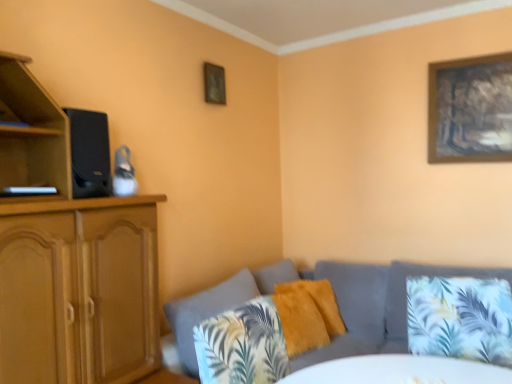
Question: From the image's perspective, does printed fabric pillow at lower right, the 1th pillow from the front, appear higher than wooden framed artwork at upper right, arranged as the second picture frame when viewed from the left?

Choices:
 (A) yes
 (B) no

Answer: (B)

Question: Is printed fabric pillow at lower right, which is counted as the 3th pillow, starting from the back, looking in the opposite direction of wooden framed artwork at upper right, which is the 1th picture frame in right-to-left order?

Choices:
 (A) no
 (B) yes

Answer: (A)

Question: From the image's perspective, is printed fabric pillow at lower right, the 1th pillow from the front, below wooden framed artwork at upper right, which is the 1th picture frame in right-to-left order?

Choices:
 (A) no
 (B) yes

Answer: (B)

Question: Is printed fabric pillow at lower right, which is counted as the 3th pillow, starting from the back, smaller than wooden framed artwork at upper right, arranged as the second picture frame when viewed from the left?

Choices:
 (A) no
 (B) yes

Answer: (A)

Question: Is printed fabric pillow at lower right, the 1th pillow from the front, far away from wooden framed artwork at upper right, which is the 1th picture frame in right-to-left order?

Choices:
 (A) no
 (B) yes

Answer: (B)

Question: Considering the relative sizes of printed fabric pillow at lower right, the 1th pillow from the front, and wooden framed artwork at upper right, arranged as the second picture frame when viewed from the left, in the image provided, is printed fabric pillow at lower right, the 1th pillow from the front, shorter than wooden framed artwork at upper right, arranged as the second picture frame when viewed from the left,?

Choices:
 (A) yes
 (B) no

Answer: (A)

Question: Does black matte speaker at left have a greater width compared to printed fabric pillow at lower right, which is counted as the 3th pillow, starting from the back?

Choices:
 (A) yes
 (B) no

Answer: (B)

Question: Are black matte speaker at left and printed fabric pillow at lower right, which is counted as the 3th pillow, starting from the back, far apart?

Choices:
 (A) yes
 (B) no

Answer: (A)

Question: Does black matte speaker at left have a greater height compared to printed fabric pillow at lower right, the 1th pillow from the front?

Choices:
 (A) yes
 (B) no

Answer: (B)

Question: Considering the relative positions of black matte speaker at left and printed fabric pillow at lower right, the 1th pillow from the front, in the image provided, is black matte speaker at left to the right of printed fabric pillow at lower right, the 1th pillow from the front, from the viewer's perspective?

Choices:
 (A) yes
 (B) no

Answer: (B)

Question: From the image's perspective, is black matte speaker at left located beneath printed fabric pillow at lower right, the 1th pillow from the front?

Choices:
 (A) yes
 (B) no

Answer: (B)

Question: Could you tell me if black matte speaker at left is turned towards printed fabric pillow at lower right, the 1th pillow from the front?

Choices:
 (A) yes
 (B) no

Answer: (B)

Question: From a real-world perspective, is fuzzy yellow pillow at center, which is the first pillow in back-to-front order, below wooden picture frame at upper center, the first picture frame when ordered from left to right?

Choices:
 (A) no
 (B) yes

Answer: (B)